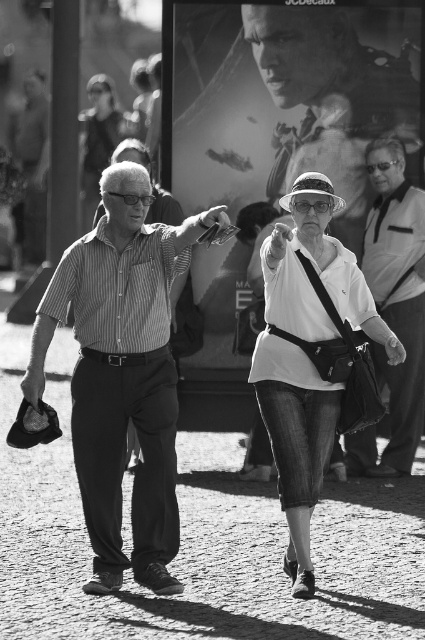
Question: Which is farther from the smooth leather jacket at right?

Choices:
 (A) striped cotton shirt at center
 (B) white matte shirt at center
 (C) white cotton shirt at right
 (D) striped cotton shirt at left

Answer: (A)

Question: Which point is farther to the camera?

Choices:
 (A) (85, 257)
 (B) (85, 256)
 (C) (323, 381)
 (D) (374, 204)

Answer: (D)

Question: Is denim jeans at center to the left of smooth skin face at center from the viewer's perspective?

Choices:
 (A) yes
 (B) no

Answer: (A)

Question: Does smooth skin face at center appear over striped cotton shirt at left?

Choices:
 (A) no
 (B) yes

Answer: (B)

Question: Does denim jeans at center appear on the left side of white matte shirt at center?

Choices:
 (A) yes
 (B) no

Answer: (B)

Question: Estimate the real-world distances between objects in this image. Which object is farther from the smooth skin face at center?

Choices:
 (A) white matte shirt at center
 (B) striped cotton shirt at center
 (C) white cotton shirt at right

Answer: (B)